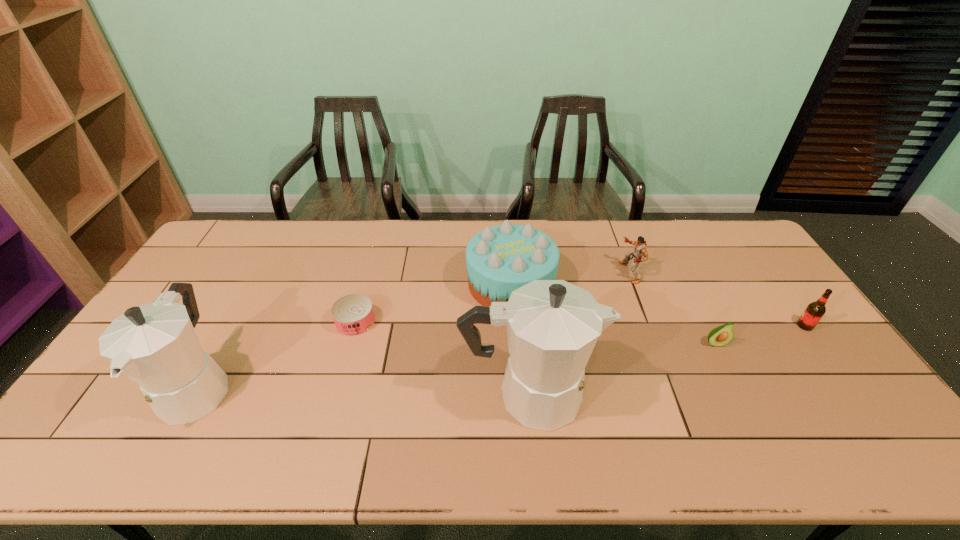
Find the location of a particular element. The height and width of the screenshot is (540, 960). the third tallest object is located at coordinates (500, 259).

Where is `vacant region located at the spout of the right coffeepot`? This screenshot has width=960, height=540. vacant region located at the spout of the right coffeepot is located at coordinates (722, 395).

This screenshot has height=540, width=960. Find the location of `free location located 0.240m on the front-facing side of the fifth object from left to right`. free location located 0.240m on the front-facing side of the fifth object from left to right is located at coordinates (548, 273).

Where is `vacant area situated on the front-facing side of the fifth object from left to right`? This screenshot has width=960, height=540. vacant area situated on the front-facing side of the fifth object from left to right is located at coordinates (530, 273).

This screenshot has height=540, width=960. Identify the location of free point located on the front-facing side of the fifth object from left to right. (516, 273).

Find the location of a particular element. This screenshot has width=960, height=540. vacant space located 0.080m on the cut side of the avocado is located at coordinates (730, 373).

You are a GUI agent. You are given a task and a screenshot of the screen. Output one action in this format:
    pyautogui.click(x=<x>, y=<y>)
    Task: Click on the vacant space located on the right of the shortest object
    
    Given the screenshot: What is the action you would take?
    pyautogui.click(x=492, y=322)

Where is `free space located on the back of the root beer`? This screenshot has height=540, width=960. free space located on the back of the root beer is located at coordinates (752, 253).

What are the coordinates of `vacant area located on the right of the third tallest object` in the screenshot? It's located at (653, 284).

This screenshot has height=540, width=960. I want to click on object that is at the far edge, so click(x=500, y=259).